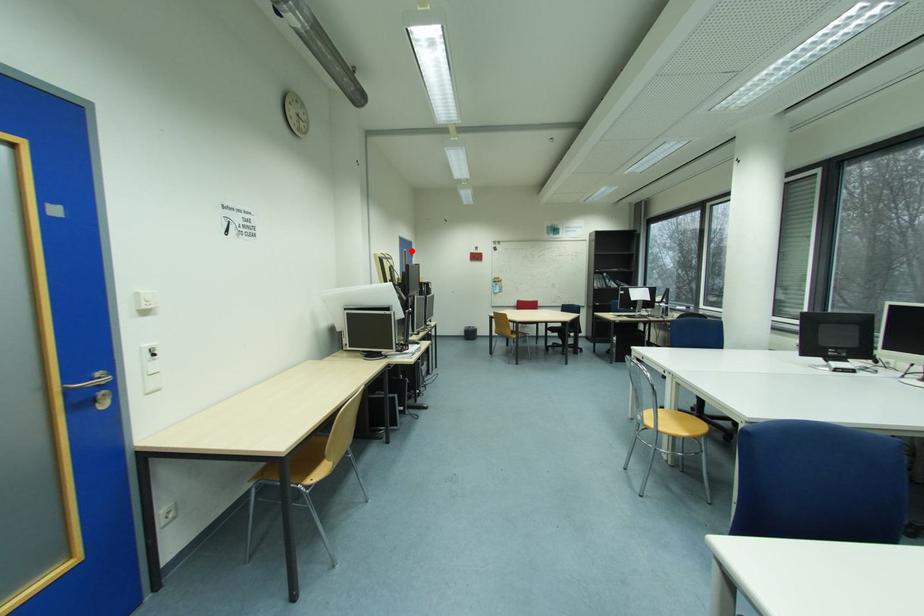
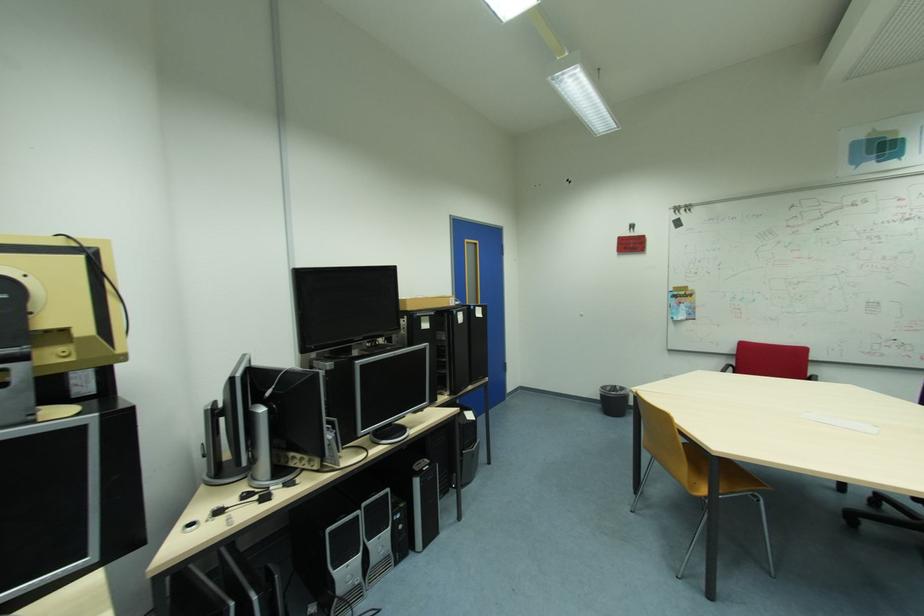
Question: I am providing you with two images of the same scene from different viewpoints. A red point is marked on the first image. At the location where the point appears in image 1, is it still visible in image 2?

Choices:
 (A) Yes
 (B) No

Answer: (A)